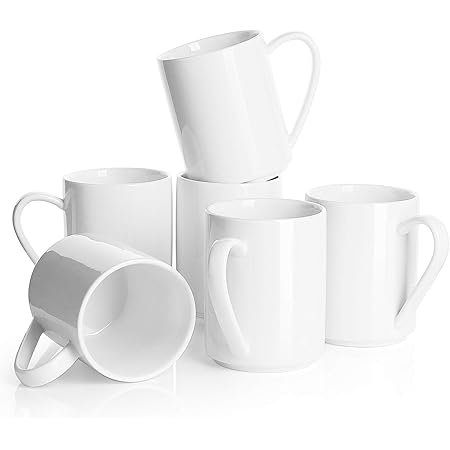
Locate an element on the screen. The width and height of the screenshot is (450, 450). white mugs is located at coordinates (77, 282), (119, 224), (194, 197), (273, 264), (379, 242), (233, 151).